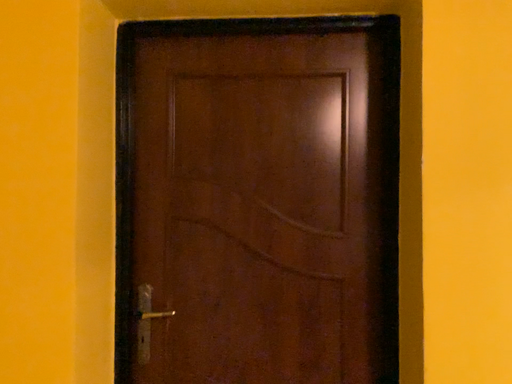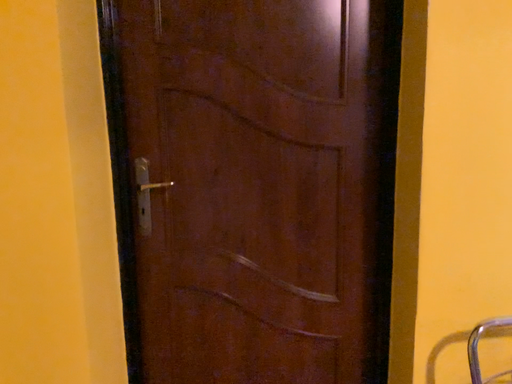
Question: Which way did the camera rotate in the video?

Choices:
 (A) rotated upward
 (B) rotated downward

Answer: (B)